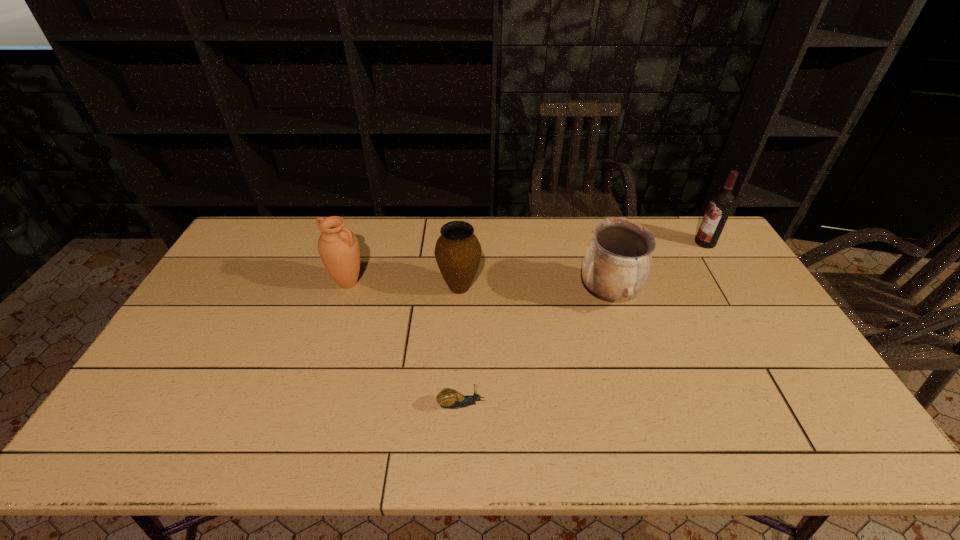
Find the location of a particular element. The width and height of the screenshot is (960, 540). the tallest object is located at coordinates (721, 203).

Locate an element on the screen. This screenshot has height=540, width=960. the farthest object is located at coordinates (721, 203).

This screenshot has width=960, height=540. In order to click on the leftmost object in this screenshot , I will do `click(338, 246)`.

You are a GUI agent. You are given a task and a screenshot of the screen. Output one action in this format:
    pyautogui.click(x=<x>, y=<y>)
    Task: Click on the rightmost urn
    
    Given the screenshot: What is the action you would take?
    pyautogui.click(x=617, y=262)

Identify the location of the second urn from left to right. (457, 252).

Identify the location of the nearest object. The image size is (960, 540). [447, 398].

Locate an element on the screen. the shortest object is located at coordinates (x=447, y=398).

Locate an element on the screen. free region located 0.170m on the label of the tallest object is located at coordinates click(648, 242).

Find the location of a particular element. The height and width of the screenshot is (540, 960). vacant space located on the label of the tallest object is located at coordinates (612, 242).

Locate an element on the screen. The width and height of the screenshot is (960, 540). vacant space situated 0.130m on the label of the tallest object is located at coordinates (659, 242).